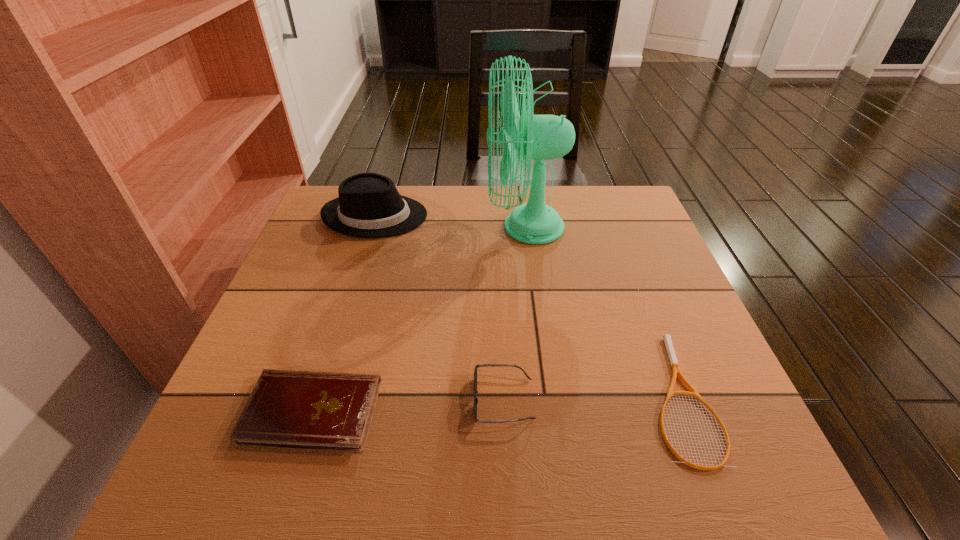
Locate an element on the screen. This screenshot has height=540, width=960. vacant area situated 0.260m on the front-facing side of the third tallest object is located at coordinates (331, 400).

Where is `vacant point located 0.050m on the front-facing side of the third tallest object`? This screenshot has width=960, height=540. vacant point located 0.050m on the front-facing side of the third tallest object is located at coordinates (446, 400).

Image resolution: width=960 pixels, height=540 pixels. In order to click on vacant space situated 0.080m on the front-facing side of the third tallest object in this screenshot , I will do `click(430, 400)`.

What are the coordinates of `vacant space located 0.270m on the right of the second shortest object` in the screenshot? It's located at (527, 411).

The image size is (960, 540). I want to click on vacant space located on the back of the shortest object, so click(x=644, y=307).

This screenshot has width=960, height=540. In order to click on fan present at the far edge in this screenshot , I will do `click(540, 137)`.

Find the location of a particular element. The image size is (960, 540). fedora situated at the far edge is located at coordinates (369, 205).

The image size is (960, 540). In order to click on notebook located at the near edge in this screenshot , I will do `click(309, 410)`.

Find the location of `tennis racket that is at the near edge`. tennis racket that is at the near edge is located at coordinates (676, 370).

Find the location of a particular element. Image resolution: width=960 pixels, height=540 pixels. fedora located in the left edge section of the desktop is located at coordinates (369, 205).